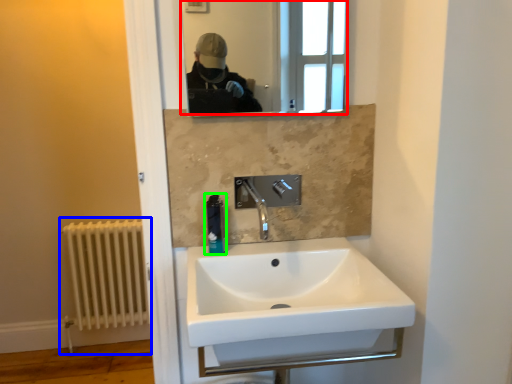
Question: Which object is the closest to the mirror (highlighted by a red box)? Choose among these: radiator (highlighted by a blue box) or soap dispenser (highlighted by a green box).

Choices:
 (A) radiator
 (B) soap dispenser

Answer: (A)